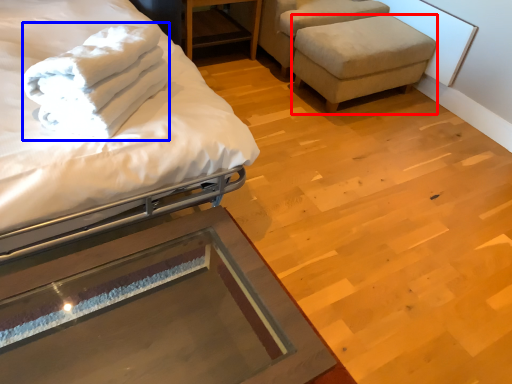
Question: Which point is closer to the camera, stool (highlighted by a red box) or bath towel (highlighted by a blue box)?

Choices:
 (A) stool
 (B) bath towel

Answer: (B)